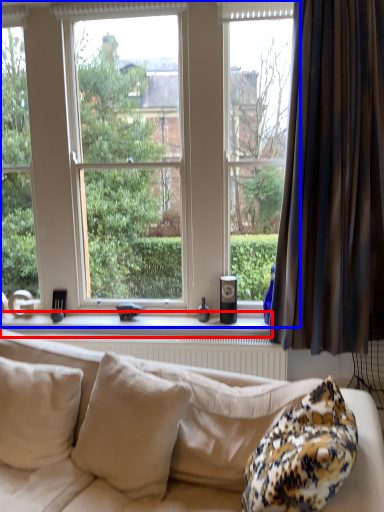
Question: Among these objects, which one is nearest to the camera, window sill (highlighted by a red box) or window (highlighted by a blue box)?

Choices:
 (A) window sill
 (B) window

Answer: (B)